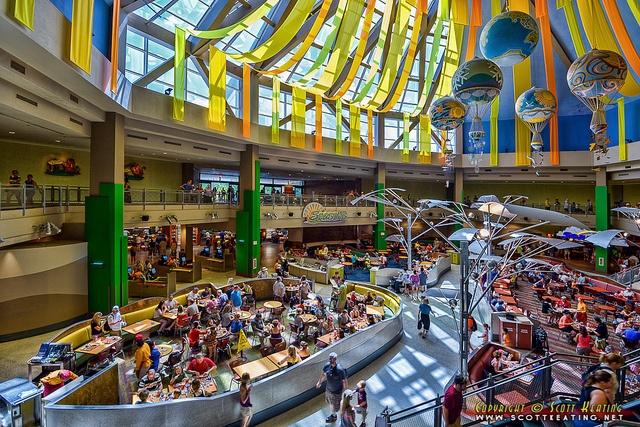
You are a GUI agent. You are given a task and a screenshot of the screen. Output one action in this format:
    pyautogui.click(x=<x>, y=<y>)
    Task: Click on the columns
    
    Given the screenshot: What is the action you would take?
    pyautogui.click(x=115, y=147), pyautogui.click(x=250, y=169), pyautogui.click(x=381, y=179), pyautogui.click(x=454, y=182), pyautogui.click(x=601, y=183)